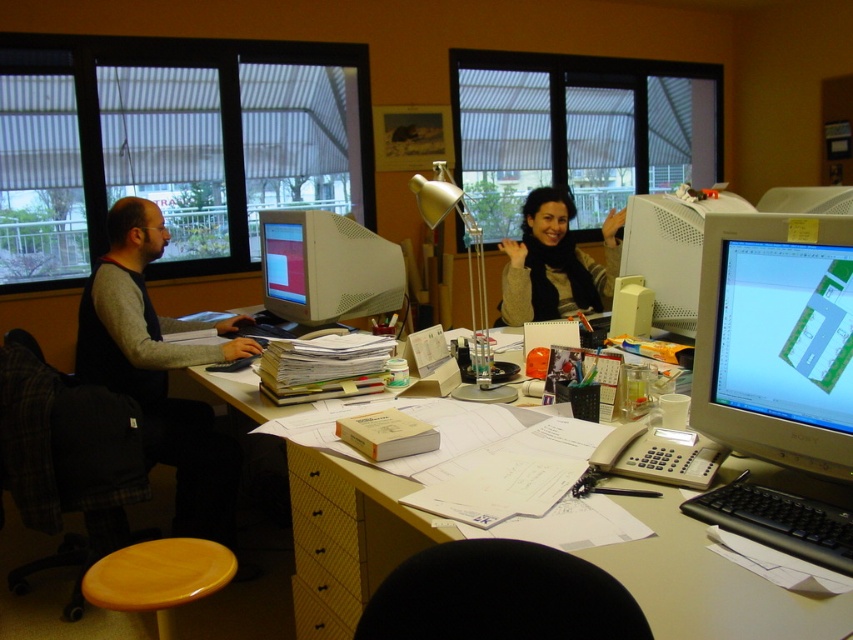
Question: Is white glossy monitor at right thinner than matte white monitor at upper right?

Choices:
 (A) no
 (B) yes

Answer: (B)

Question: Does matte yellow desk at center lie in front of yellow plastic stool at lower left?

Choices:
 (A) no
 (B) yes

Answer: (B)

Question: Which object appears farthest from the camera in this image?

Choices:
 (A) white glossy computer monitor at center right
 (B) dark gray sweater at left
 (C) matte yellow desk at center

Answer: (B)

Question: Does dark gray sweater at left have a lesser width compared to gold metallic desk lamp at center?

Choices:
 (A) no
 (B) yes

Answer: (A)

Question: Among these points, which one is nearest to the camera?

Choices:
 (A) (318, 314)
 (B) (672, 200)

Answer: (B)

Question: Which is nearer to the yellow plastic stool at lower left?

Choices:
 (A) matte white monitor at upper right
 (B) white plastic monitor at center
 (C) matte yellow desk at center
 (D) black leather chair at lower center

Answer: (D)